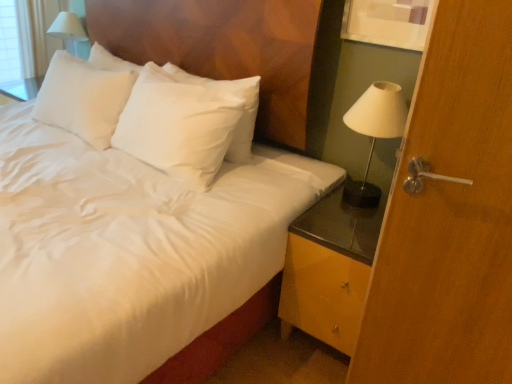
What do you see at coordinates (67, 27) in the screenshot?
I see `white glossy table lamp at upper left` at bounding box center [67, 27].

Where is `yellow glossy nightstand at lower right`? yellow glossy nightstand at lower right is located at coordinates (329, 270).

The width and height of the screenshot is (512, 384). I want to click on white satin pillow at upper center, so tap(236, 95).

The height and width of the screenshot is (384, 512). Describe the element at coordinates (374, 133) in the screenshot. I see `white glossy lamp at right` at that location.

Locate an element on the screen. white satin bed at center is located at coordinates (224, 48).

Where is `white glossy table lamp at upper left`? white glossy table lamp at upper left is located at coordinates (67, 27).

Can you confirm if white satin bed at center is positioned to the right of white glossy table lamp at upper left?

Yes.

Is white glossy table lamp at upper left inside white satin bed at center?

No, white glossy table lamp at upper left is not surrounded by white satin bed at center.

Does point (131, 26) appear closer or farther from the camera than point (59, 22)?

Point (131, 26) is positioned closer to the camera compared to point (59, 22).

Based on the photo, can you confirm if white glossy lamp at right is bigger than wooden door handle at right?

Actually, white glossy lamp at right might be smaller than wooden door handle at right.

From the image's perspective, is white glossy lamp at right below wooden door handle at right?

No, from the image's perspective, white glossy lamp at right is not beneath wooden door handle at right.

From a real-world perspective, is white glossy lamp at right above or below wooden door handle at right?

From a real-world perspective, white glossy lamp at right is physically above wooden door handle at right.

Does white glossy lamp at right have a lesser width compared to wooden door handle at right?

No, white glossy lamp at right is not thinner than wooden door handle at right.

Does wooden door handle at right appear on the right side of yellow glossy nightstand at lower right?

Correct, you'll find wooden door handle at right to the right of yellow glossy nightstand at lower right.

Does wooden door handle at right have a larger size compared to yellow glossy nightstand at lower right?

No, wooden door handle at right is not bigger than yellow glossy nightstand at lower right.

Which object is more forward, wooden door handle at right or yellow glossy nightstand at lower right?

wooden door handle at right is in front.

Is wooden door handle at right positioned with its back to yellow glossy nightstand at lower right?

Yes, wooden door handle at right is positioned with its back facing yellow glossy nightstand at lower right.

Does white glossy lamp at right have a greater height compared to white satin bed at center?

No, white glossy lamp at right is not taller than white satin bed at center.

Identify the location of bedside lamp that appears above the white satin bed at center (from the image's perspective). This screenshot has width=512, height=384. (374, 133).

From a real-world perspective, is white glossy lamp at right physically located above or below white satin bed at center?

white glossy lamp at right is situated higher than white satin bed at center in the real world.

Which of these two, white satin pillow at upper center or yellow glossy nightstand at lower right, is wider?

yellow glossy nightstand at lower right is wider.

From a real-world perspective, is white satin pillow at upper center physically above yellow glossy nightstand at lower right?

Indeed, from a real-world perspective, white satin pillow at upper center stands above yellow glossy nightstand at lower right.

Does white satin pillow at upper center have a larger size compared to yellow glossy nightstand at lower right?

No.

Does point (243, 160) come farther from viewer compared to point (356, 225)?

Yes, point (243, 160) is behind point (356, 225).

From a real-world perspective, which object rests below the other?

In real-world perspective, white glossy lamp at right is lower.

Looking at this image, would you say white satin pillow at upper center is part of white glossy lamp at right's contents?

Definitely not — white satin pillow at upper center is not inside white glossy lamp at right.

Where is `pillow behind the white glossy lamp at right`? The height and width of the screenshot is (384, 512). pillow behind the white glossy lamp at right is located at coordinates (236, 95).

Can you see white glossy lamp at right touching white satin pillow at upper center?

No, white glossy lamp at right is not touching white satin pillow at upper center.

Considering the relative sizes of white satin pillow at upper center and white glossy lamp at right in the image provided, is white satin pillow at upper center wider than white glossy lamp at right?

Incorrect, the width of white satin pillow at upper center does not surpass that of white glossy lamp at right.

From the image's perspective, which object appears higher, white satin pillow at upper center or white glossy lamp at right?

white satin pillow at upper center is shown above in the image.

From the picture: Is white satin pillow at upper center further to camera compared to white glossy lamp at right?

Yes.

Where is `pillow positioned vertically above the white glossy lamp at right (from a real-world perspective)`? The image size is (512, 384). pillow positioned vertically above the white glossy lamp at right (from a real-world perspective) is located at coordinates (236, 95).

The image size is (512, 384). Find the location of `table lamp that appears above the white satin bed at center (from a real-world perspective)`. table lamp that appears above the white satin bed at center (from a real-world perspective) is located at coordinates (67, 27).

You are a GUI agent. You are given a task and a screenshot of the screen. Output one action in this format:
    pyautogui.click(x=<x>, y=<y>)
    Task: Click on the bedside lamp that is on the left side of wooden door handle at right
    
    Given the screenshot: What is the action you would take?
    pyautogui.click(x=374, y=133)

From the image, which object appears to be nearer to white glossy lamp at right, yellow glossy nightstand at lower right or wooden door handle at right?

The object closer to white glossy lamp at right is yellow glossy nightstand at lower right.

Considering their positions, is yellow glossy nightstand at lower right positioned closer to white glossy lamp at right than white satin bed at center?

The object closer to white glossy lamp at right is yellow glossy nightstand at lower right.

Based on their spatial positions, is wooden door handle at right or white glossy lamp at right further from white satin pillow at upper center?

wooden door handle at right lies further to white satin pillow at upper center than the other object.

Estimate the real-world distances between objects in this image. Which object is closer to wooden door handle at right, white satin pillow at upper center or white glossy lamp at right?

white glossy lamp at right is positioned closer to the anchor wooden door handle at right.

Which object lies nearer to the anchor point wooden door handle at right, white glossy table lamp at upper left or white satin bed at center?

white satin bed at center lies closer to wooden door handle at right than the other object.

Considering their positions, is white satin bed at center positioned closer to white glossy table lamp at upper left than wooden door handle at right?

Based on the image, white satin bed at center appears to be nearer to white glossy table lamp at upper left.

Based on their spatial positions, is yellow glossy nightstand at lower right or white glossy lamp at right closer to white satin bed at center?

white glossy lamp at right lies closer to white satin bed at center than the other object.

From the image, which object appears to be nearer to wooden door handle at right, white glossy table lamp at upper left or yellow glossy nightstand at lower right?

yellow glossy nightstand at lower right.

Locate an element on the screen. The height and width of the screenshot is (384, 512). nightstand between white satin bed at center and wooden door handle at right is located at coordinates (329, 270).

Find the location of a particular element. The width and height of the screenshot is (512, 384). screen door between white satin bed at center and white glossy table lamp at upper left in the front-back direction is located at coordinates (449, 216).

Find the location of a particular element. pillow located between white satin bed at center and white glossy table lamp at upper left in the depth direction is located at coordinates (236, 95).

The image size is (512, 384). In order to click on nightstand between white glossy table lamp at upper left and wooden door handle at right in this screenshot , I will do `click(329, 270)`.